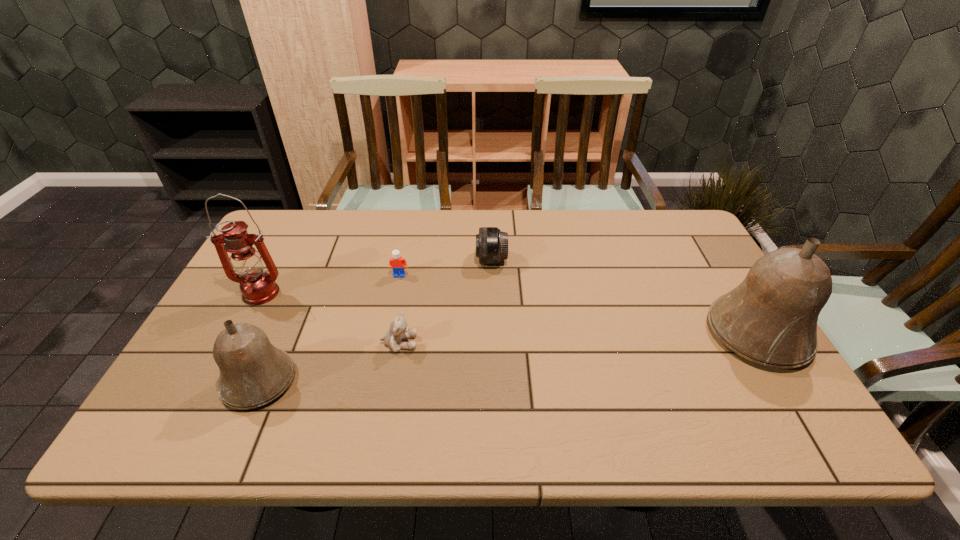
You are a GUI agent. You are given a task and a screenshot of the screen. Output one action in this format:
    pyautogui.click(x=<x>, y=<y>)
    Task: Click on the vacant position for inserting another bell evenly
    Image resolution: width=960 pixels, height=540 pixels.
    Given the screenshot: What is the action you would take?
    pyautogui.click(x=520, y=356)